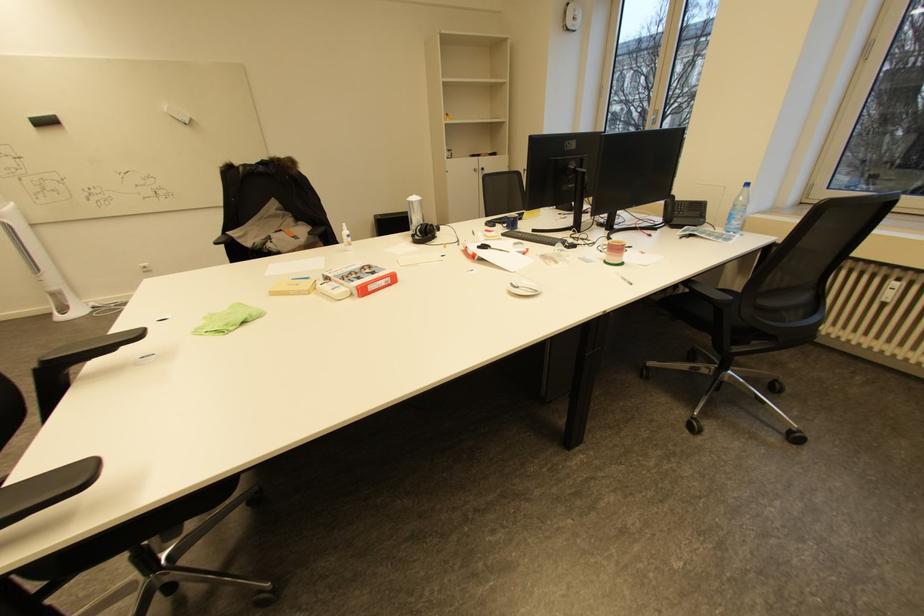
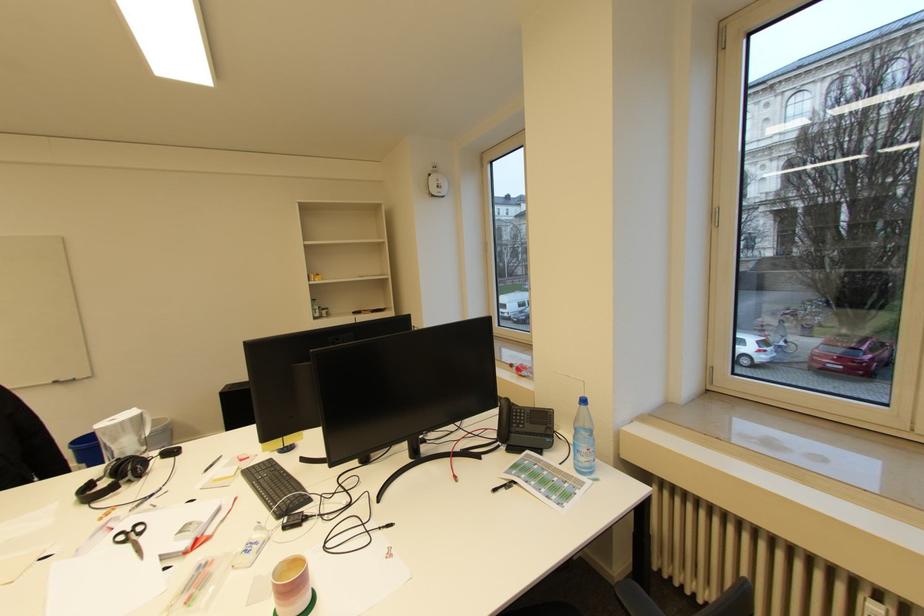
Locate, in the second image, the point that corresponds to the point at 488,246 in the first image.

(141, 525)